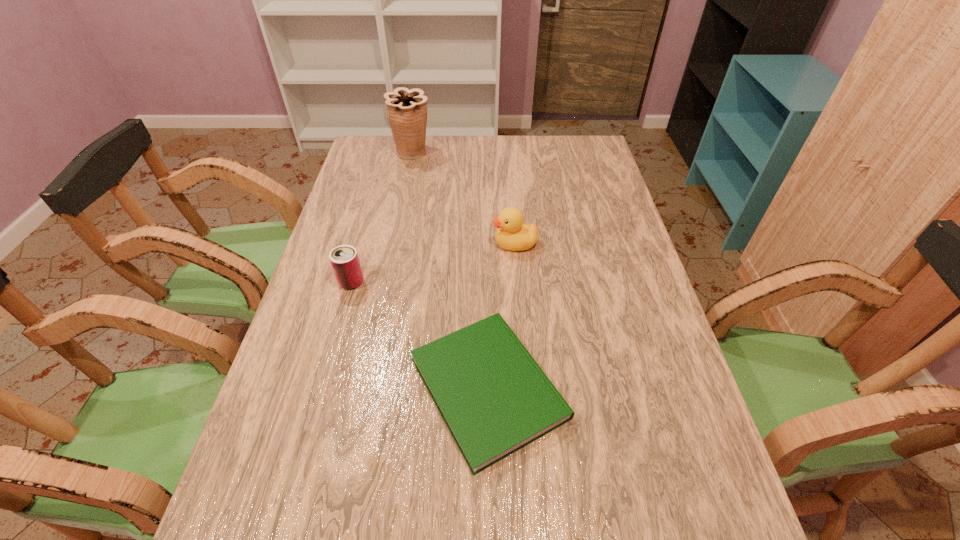
Where is `the tallest object`? This screenshot has height=540, width=960. the tallest object is located at coordinates (406, 109).

Locate an element on the screen. The height and width of the screenshot is (540, 960). the farthest object is located at coordinates (406, 109).

The image size is (960, 540). Find the location of `the second tallest object`. the second tallest object is located at coordinates (512, 234).

Identify the location of duck. Image resolution: width=960 pixels, height=540 pixels. (512, 234).

Find the location of a particular element. The width and height of the screenshot is (960, 540). the third tallest object is located at coordinates (344, 259).

The image size is (960, 540). I want to click on can, so click(344, 259).

Image resolution: width=960 pixels, height=540 pixels. I want to click on paperback book, so click(x=495, y=399).

Where is `the nearest object`? the nearest object is located at coordinates (495, 399).

Where is `blank space located 0.120m on the front of the tallest object`? blank space located 0.120m on the front of the tallest object is located at coordinates (406, 184).

Locate an element on the screen. The height and width of the screenshot is (540, 960). vacant space located 0.210m at the beak of the third shortest object is located at coordinates (420, 244).